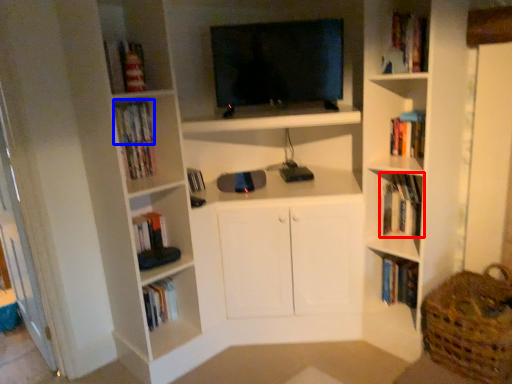
Question: Among these objects, which one is farthest to the camera, book (highlighted by a red box) or book (highlighted by a blue box)?

Choices:
 (A) book
 (B) book

Answer: (A)